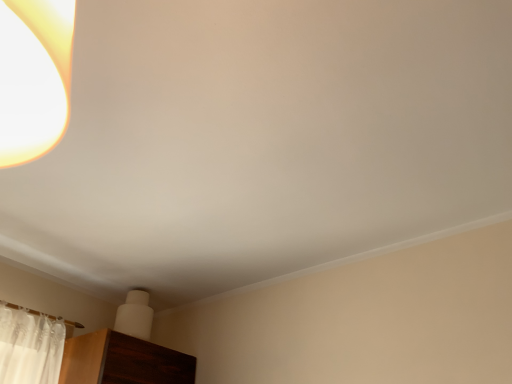
This screenshot has width=512, height=384. What do you see at coordinates (135, 315) in the screenshot? I see `white matte lampshade at upper left` at bounding box center [135, 315].

The height and width of the screenshot is (384, 512). In order to click on white matte lampshade at upper left in this screenshot , I will do `click(135, 315)`.

Based on the photo, measure the distance between white matte lampshade at upper left and camera.

white matte lampshade at upper left is 1.81 meters from camera.

The height and width of the screenshot is (384, 512). In order to click on white matte lampshade at upper left in this screenshot , I will do `click(135, 315)`.